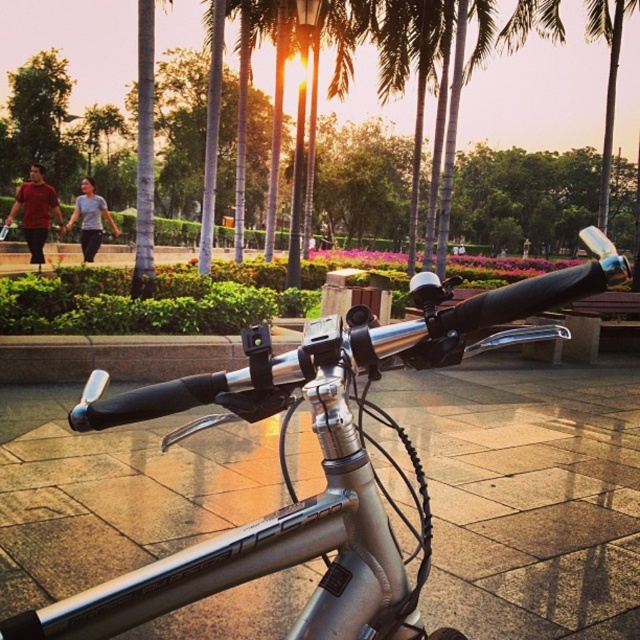
The width and height of the screenshot is (640, 640). What do you see at coordinates (321, 461) in the screenshot? I see `silver metallic bicycle handlebars at center` at bounding box center [321, 461].

Can you confirm if silver metallic bicycle handlebars at center is positioned to the right of light blue cotton shirt at center?

Correct, you'll find silver metallic bicycle handlebars at center to the right of light blue cotton shirt at center.

Between point (358, 397) and point (88, 196), which one is positioned behind?

The point (88, 196) is more distant.

Locate an element on the screen. The width and height of the screenshot is (640, 640). silver metallic bicycle handlebars at center is located at coordinates (321, 461).

Between point (49, 209) and point (104, 211), which one is positioned behind?

Positioned behind is point (104, 211).

Is matte red shirt at left taller than light blue cotton shirt at center?

No.

Which is behind, point (28, 221) or point (67, 224)?

Positioned behind is point (67, 224).

Identify the location of matte red shirt at left. The width and height of the screenshot is (640, 640). (35, 211).

Measure the distance from silver metallic bicycle handlebars at center to matte red shirt at left.

silver metallic bicycle handlebars at center is 9.40 meters away from matte red shirt at left.

Does silver metallic bicycle handlebars at center appear over matte red shirt at left?

Actually, silver metallic bicycle handlebars at center is below matte red shirt at left.

At what (x,y) coordinates should I click in order to perform the action: click on silver metallic bicycle handlebars at center. Please return your answer as a coordinate pair (x, y). The width and height of the screenshot is (640, 640). Looking at the image, I should click on (321, 461).

Locate an element on the screen. Image resolution: width=640 pixels, height=640 pixels. silver metallic bicycle handlebars at center is located at coordinates (x=321, y=461).